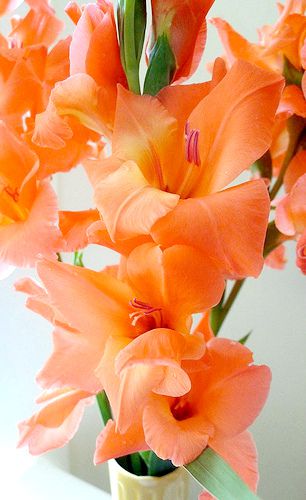
I want to click on wall in background, so click(x=277, y=327).